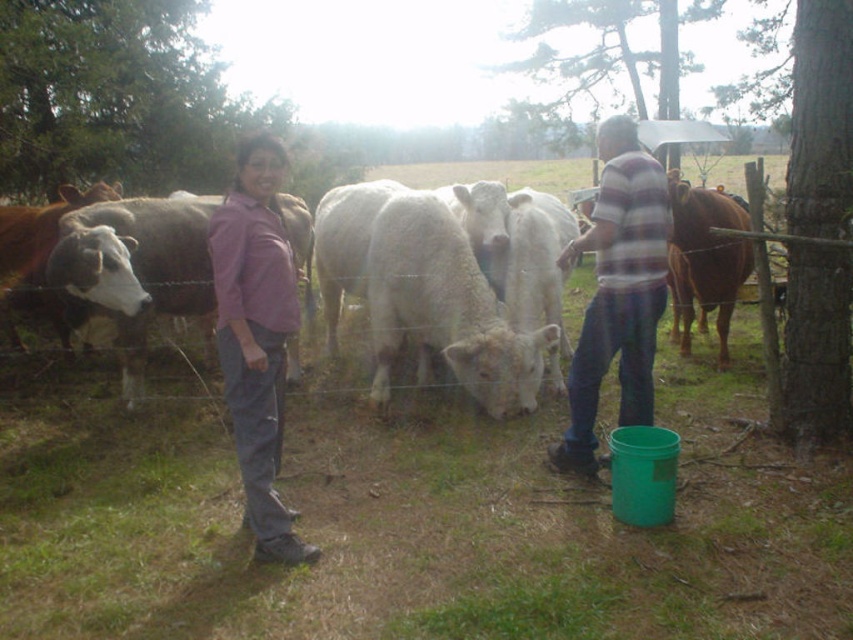
In the rural scene described, there is a woman wearing a purple cotton shirt at center and a brown glossy cow at right. From the perspective of an observer looking at the image, which object is positioned more to the left?

The purple cotton shirt at center is positioned to the left of the brown glossy cow at right.

You are a photographer trying to capture a group photo of the purple cotton shirt at center and the brown glossy cow at right. Given their height difference, which one should you adjust your camera angle to focus on to ensure both are in frame without cropping?

The purple cotton shirt at center is much taller than the brown glossy cow at right, so you should lower your camera angle to focus on the brown glossy cow at right to include both in the frame without cropping.

You are standing at the point labeled point (254, 292) and want to walk to the point labeled point (701, 216). Which direction should you face to walk directly towards your destination?

You should face north to walk directly towards point (701, 216) from point (254, 292).